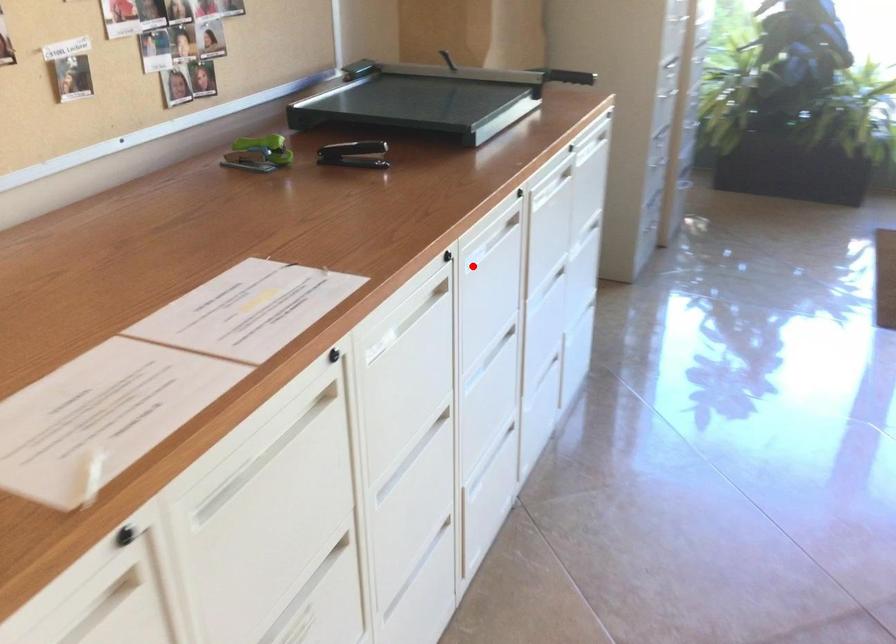
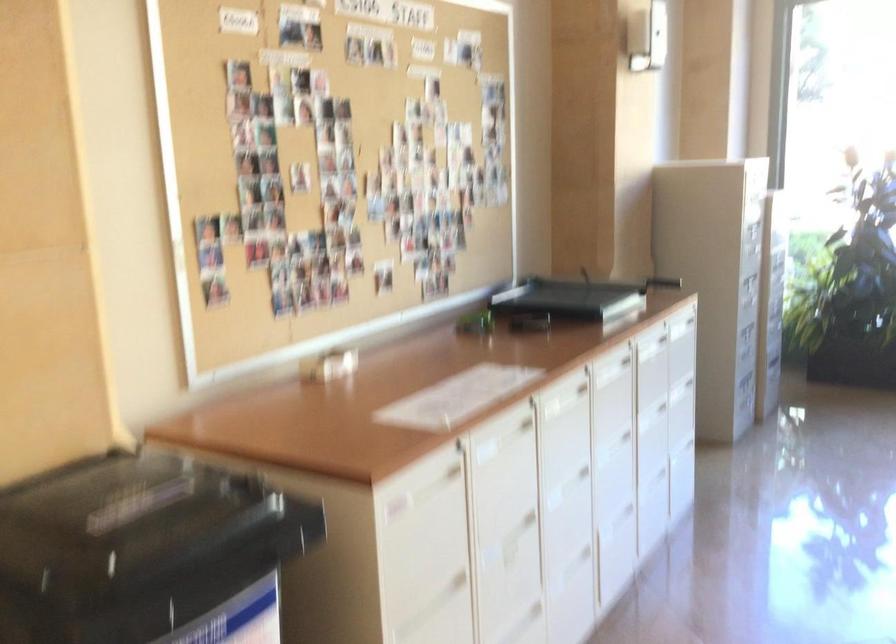
In the second image, find the point that corresponds to the highlighted location in the first image.

(605, 379)